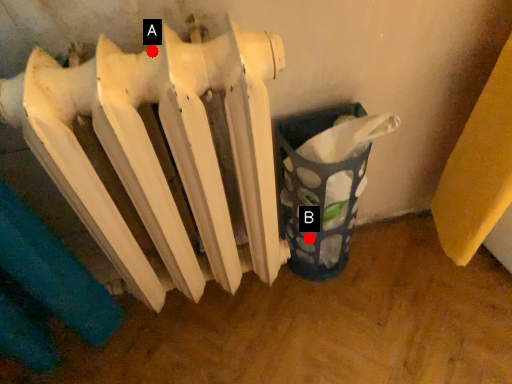
Question: Two points are circled on the image, labeled by A and B beside each circle. Which point appears closest to the camera in this image?

Choices:
 (A) A is closer
 (B) B is closer

Answer: (A)